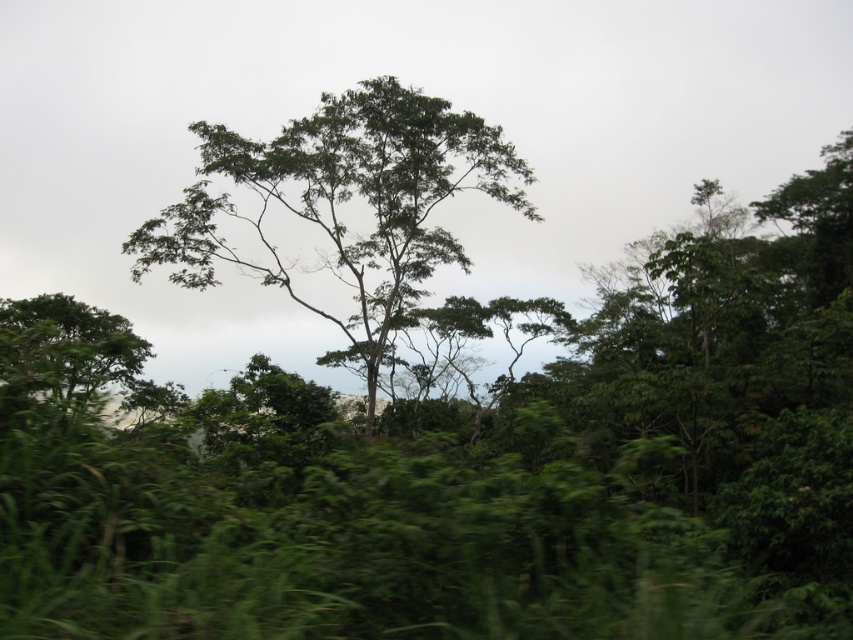
You are hiking through the forest and want to take a photo of both the green leafy tree at center and the green leafy tree at lower left. Which tree should you move closer to in order to capture both in the same frame?

You should move closer to the green leafy tree at lower left since the green leafy tree at center is closer to you, so moving towards the farther tree would help include both in the frame.

You are standing in the forest and see a green leafy tree at center. There is a point marked at coordinates (343, 204). Is this point located on the green leafy tree at center?

Yes, the point (343, 204) is located on the green leafy tree at center.

You are a hiker trying to navigate through the forest. You see the green leafy tree at center and the green leafy tree at lower left. If you want to walk directly between them, how far apart are they?

The distance between the green leafy tree at center and the green leafy tree at lower left is 44.25 feet, so you would need to walk that distance to go between them.